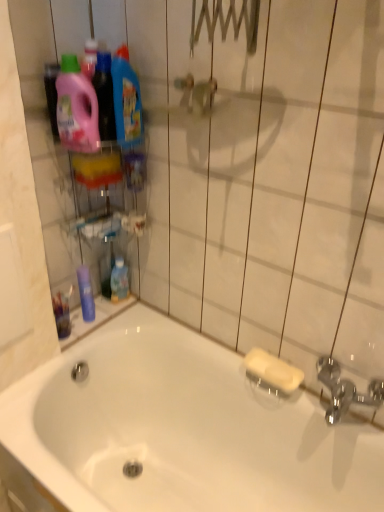
Question: Visually, is blue glossy mouthwash at lower center, which is the first mouthwash from right to left, positioned to the left or to the right of blue glossy mouthwash at left, which is the 1th mouthwash from left to right?

Choices:
 (A) right
 (B) left

Answer: (A)

Question: From a real-world perspective, relative to blue glossy mouthwash at left, which appears as the 2th mouthwash when viewed from the right, is blue glossy mouthwash at lower center, which is the first mouthwash from right to left, vertically above or below?

Choices:
 (A) above
 (B) below

Answer: (B)

Question: Which is nearer to the white glossy bathtub at lower left?

Choices:
 (A) blue glossy mouthwash at left, which is the 1th mouthwash from left to right
 (B) blue glossy mouthwash at lower center, which is the first mouthwash from right to left
 (C) pink plastic detergent at upper left, the first cleaning product positioned from the left
 (D) blue glossy detergent at upper left, the first cleaning product viewed from the right

Answer: (A)

Question: Which object is the farthest from the white glossy bathtub at lower left?

Choices:
 (A) blue glossy detergent at upper left, the first cleaning product viewed from the right
 (B) pink plastic detergent at upper left, the first cleaning product positioned from the left
 (C) blue glossy mouthwash at left, which is the 1th mouthwash from left to right
 (D) blue glossy mouthwash at lower center, which is the first mouthwash from right to left

Answer: (A)